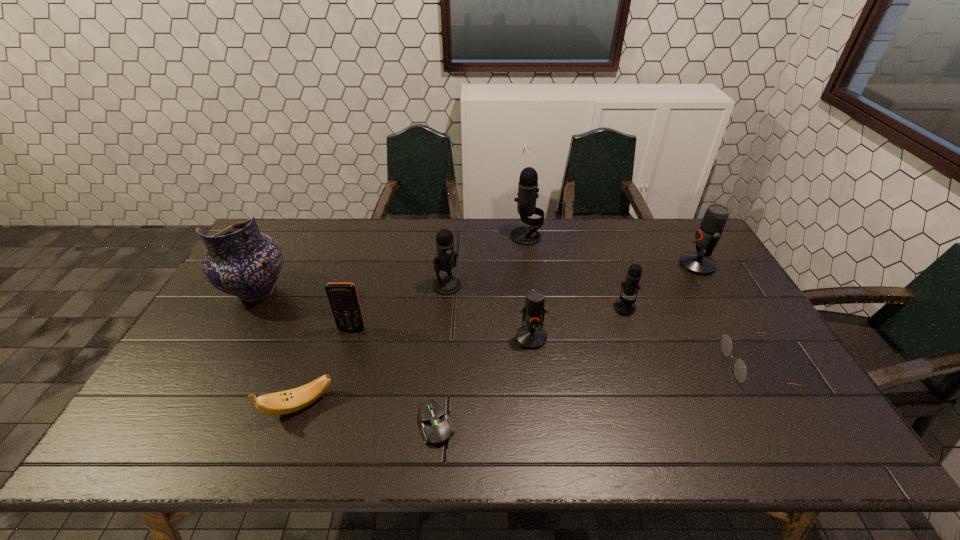
Locate an element on the screen. Image resolution: width=960 pixels, height=540 pixels. free region at the near edge of the desktop is located at coordinates (517, 435).

Where is `free space at the left edge of the desktop`? Image resolution: width=960 pixels, height=540 pixels. free space at the left edge of the desktop is located at coordinates (225, 315).

Where is `vacant space at the right edge of the desktop`? vacant space at the right edge of the desktop is located at coordinates (747, 310).

The height and width of the screenshot is (540, 960). Identify the location of blank space at the far right corner. (689, 223).

At what (x,y) coordinates should I click in order to perform the action: click on unoccupied position between the gold spectacles and the gray computer mouse. Please return your answer as a coordinate pair (x, y). Looking at the image, I should click on (595, 395).

The height and width of the screenshot is (540, 960). What are the coordinates of `free spot between the nearer red microphone and the yellow banana` in the screenshot? It's located at (416, 372).

Where is `vacant area that lies between the fourth microphone from left to right and the pottery`? vacant area that lies between the fourth microphone from left to right and the pottery is located at coordinates (441, 300).

You are a GUI agent. You are given a task and a screenshot of the screen. Output one action in this format:
    pyautogui.click(x=<x>, y=<y>)
    Task: Click on the vacant space that's between the farthest microphone and the leftmost microphone
    Image resolution: width=960 pixels, height=540 pixels.
    Given the screenshot: What is the action you would take?
    pyautogui.click(x=487, y=261)

Where is `vacant region between the shortest object and the second farthest microphone`? This screenshot has width=960, height=540. vacant region between the shortest object and the second farthest microphone is located at coordinates (567, 345).

Locate an element on the screen. The height and width of the screenshot is (540, 960). free space between the tallest microphone and the leftmost object is located at coordinates (392, 264).